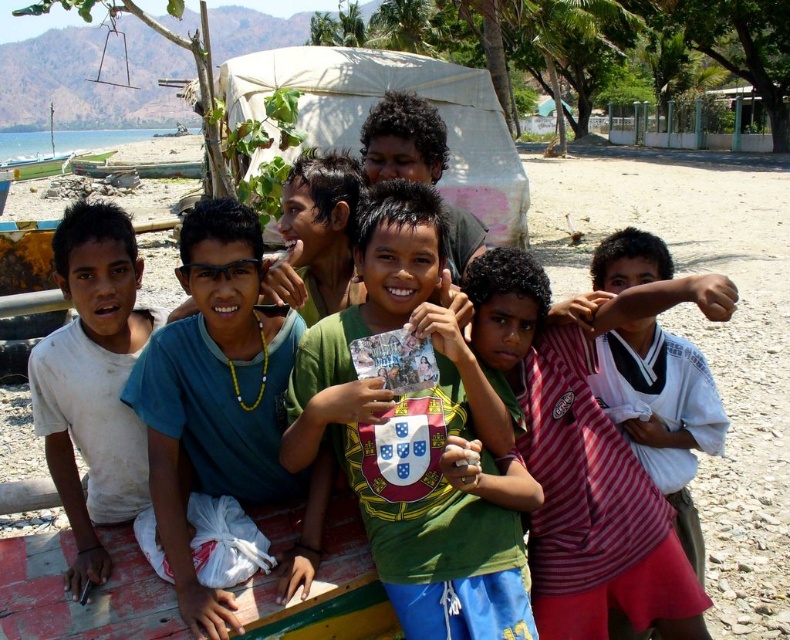
Who is more distant from viewer, (520, 262) or (213, 632)?

The point (520, 262) is more distant.

Is striped fabric shirt at center below blue fabric shirt at center?

Correct, striped fabric shirt at center is located below blue fabric shirt at center.

Which is behind, point (499, 372) or point (182, 273)?

Point (499, 372)

This screenshot has width=790, height=640. In order to click on striped fabric shirt at center in this screenshot , I will do `click(577, 472)`.

Does white matte shirt at left have a greater height compared to white plastic boat at left?

In fact, white matte shirt at left may be shorter than white plastic boat at left.

Which is above, white matte shirt at left or white plastic boat at left?

Positioned higher is white plastic boat at left.

Locate an element on the screen. The height and width of the screenshot is (640, 790). white matte shirt at left is located at coordinates click(93, 381).

In order to click on white matte shirt at left in this screenshot , I will do `click(93, 381)`.

The image size is (790, 640). What do you see at coordinates (222, 404) in the screenshot? I see `blue fabric shirt at center` at bounding box center [222, 404].

Is point (185, 557) less distant than point (81, 289)?

Yes, point (185, 557) is closer to viewer.

Find the location of a particular element. blue fabric shirt at center is located at coordinates (222, 404).